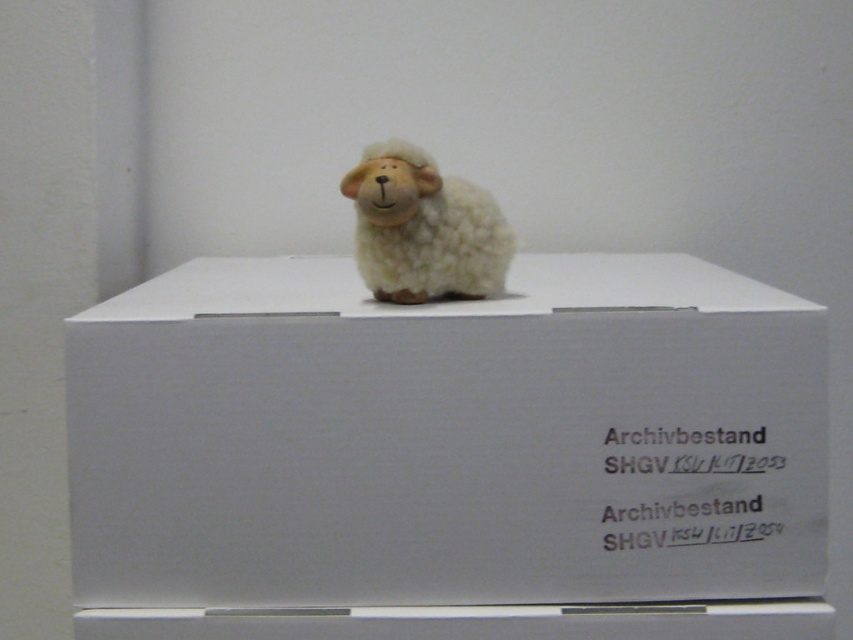
You are organizing a toy store and have a fluffy white sheep at center and a white matte cardboard box at center. Which item should you place in the storage area if you want to store the larger item?

The white matte cardboard box at center is larger in size than the fluffy white sheep at center, so you should store the white matte cardboard box at center in the storage area.

You are an archivist organizing items in a storage room. You need to place a small sheep figurine on a white box. The box has a specific location marked by the point at coordinates (447, 438). Where should you place the sheep figurine relative to the box?

The point at coordinates (447, 438) is on the white matte cardboard box at center, so you should place the sheep figurine on top of the white matte cardboard box at center where the marked point is located.

Consider the image. What is the 2D coordinate of the white matte cardboard box at center?

The white matte cardboard box at center is located at the 2D coordinate point of (447, 438).